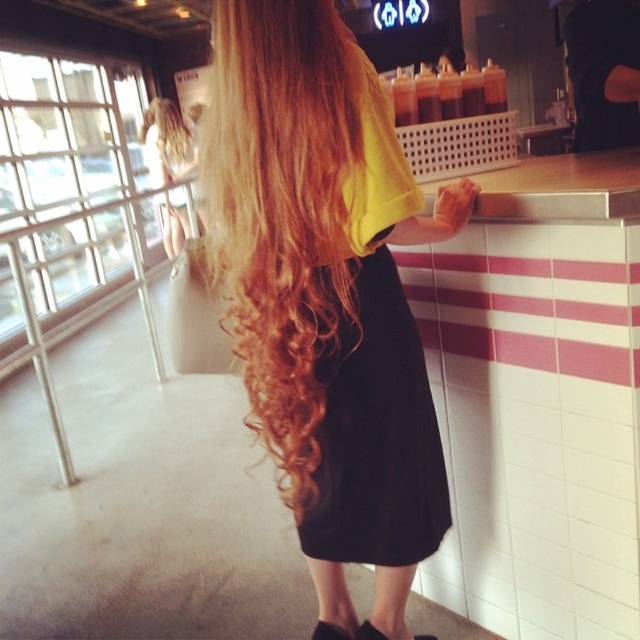
How much distance is there between blonde hair at center and black fabric sandal at lower center?

They are 61.68 centimeters apart.

Can you confirm if blonde hair at center is wider than black fabric sandal at lower center?

Yes, blonde hair at center is wider than black fabric sandal at lower center.

Does point (285, 54) come closer to viewer compared to point (364, 637)?

Yes.

Identify the location of blonde hair at center. (326, 292).

Based on the photo, can you confirm if black leather sandal at lower center is thinner than black fabric sandal at lower center?

Correct, black leather sandal at lower center's width is less than black fabric sandal at lower center's.

Between black leather sandal at lower center and black fabric sandal at lower center, which one has less height?

With less height is black leather sandal at lower center.

You are a GUI agent. You are given a task and a screenshot of the screen. Output one action in this format:
    pyautogui.click(x=<x>, y=<y>)
    Task: Click on the black leather sandal at lower center
    
    Given the screenshot: What is the action you would take?
    pyautogui.click(x=332, y=632)

The height and width of the screenshot is (640, 640). In order to click on black leather sandal at lower center in this screenshot , I will do `click(332, 632)`.

Is blonde hair at center above black leather sandal at lower center?

Yes, blonde hair at center is above black leather sandal at lower center.

Which is in front, point (384, 429) or point (346, 632)?

Point (384, 429) is more forward.

Find the location of a particular element. The image size is (640, 640). blonde hair at center is located at coordinates (326, 292).